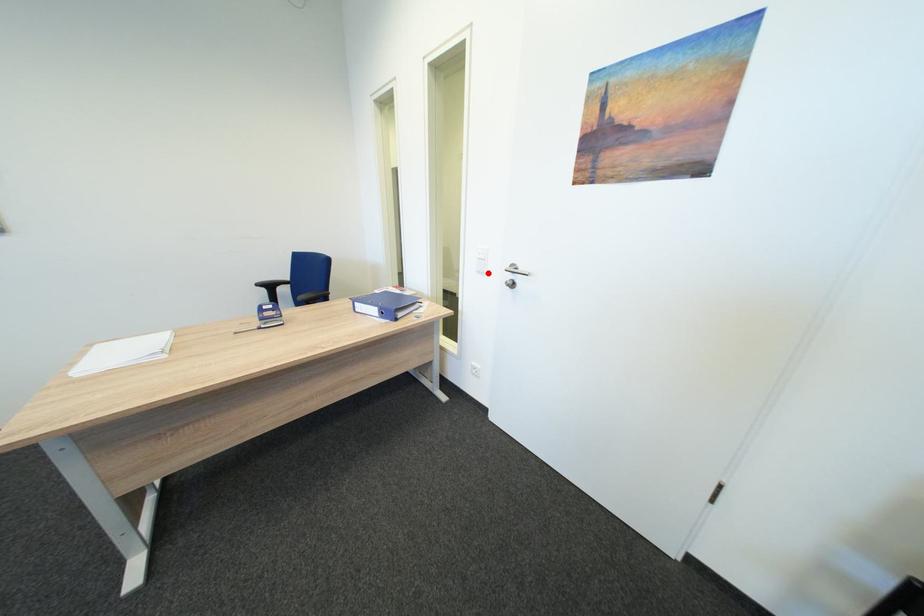
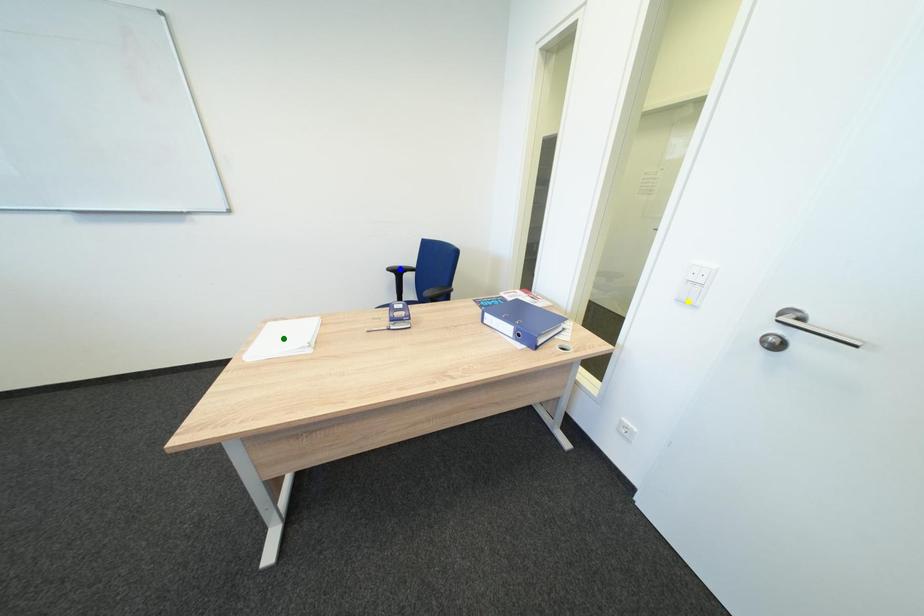
Question: I am providing you with two images of the same scene from different viewpoints. A red point is marked on the first image. You are given multiple points on the second image. Which point in image 2 represents the same 3d spot as the red point in image 1?

Choices:
 (A) blue point
 (B) green point
 (C) yellow point

Answer: (C)